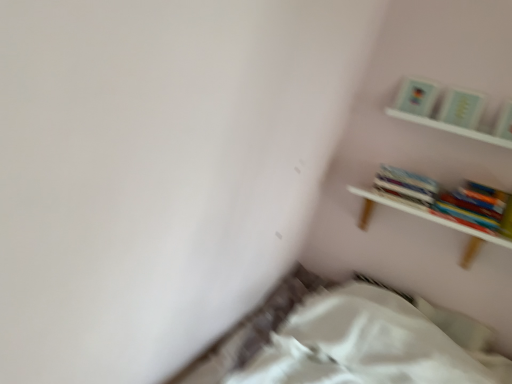
Question: Could you tell me if hardcover books at upper right is turned towards white fabric bed at lower center?

Choices:
 (A) no
 (B) yes

Answer: (A)

Question: Does hardcover books at upper right come in front of white fabric bed at lower center?

Choices:
 (A) no
 (B) yes

Answer: (A)

Question: Can you confirm if hardcover books at upper right is taller than white fabric bed at lower center?

Choices:
 (A) yes
 (B) no

Answer: (B)

Question: Is hardcover books at upper right surrounding white fabric bed at lower center?

Choices:
 (A) no
 (B) yes

Answer: (A)

Question: Is hardcover books at upper right directly adjacent to white fabric bed at lower center?

Choices:
 (A) yes
 (B) no

Answer: (B)

Question: Is hardcover books at upper right wider than white fabric bed at lower center?

Choices:
 (A) yes
 (B) no

Answer: (B)

Question: Could you tell me if white wooden shelf at upper right, the 2th shelf positioned from the top, is facing white fabric bed at lower center?

Choices:
 (A) yes
 (B) no

Answer: (B)

Question: Would you consider white wooden shelf at upper right, the 2th shelf positioned from the top, to be distant from white fabric bed at lower center?

Choices:
 (A) no
 (B) yes

Answer: (A)

Question: From the image's perspective, is white wooden shelf at upper right, the 2th shelf positioned from the top, over white fabric bed at lower center?

Choices:
 (A) no
 (B) yes

Answer: (B)

Question: Is white wooden shelf at upper right, which is the first shelf from bottom to top, turned away from white fabric bed at lower center?

Choices:
 (A) yes
 (B) no

Answer: (B)

Question: Is white wooden shelf at upper right, the 2th shelf positioned from the top, surrounding white fabric bed at lower center?

Choices:
 (A) yes
 (B) no

Answer: (B)

Question: Is white wooden shelf at upper right, which is the first shelf from bottom to top, taller than white fabric bed at lower center?

Choices:
 (A) yes
 (B) no

Answer: (B)

Question: Is white wooden shelf at upper right, which is the first shelf from bottom to top, thinner than hardcover books at upper right?

Choices:
 (A) yes
 (B) no

Answer: (B)